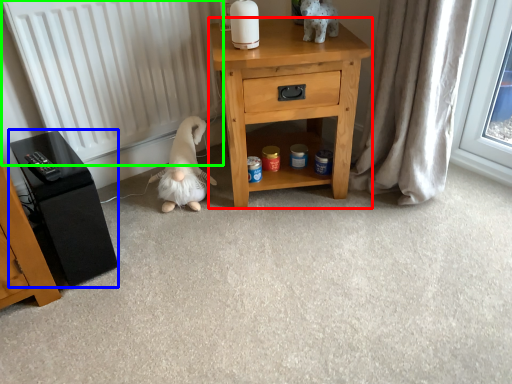
Question: Which object is positioned farthest from nightstand (highlighted by a red box)? Select from vanity (highlighted by a blue box) and radiator (highlighted by a green box).

Choices:
 (A) vanity
 (B) radiator

Answer: (A)